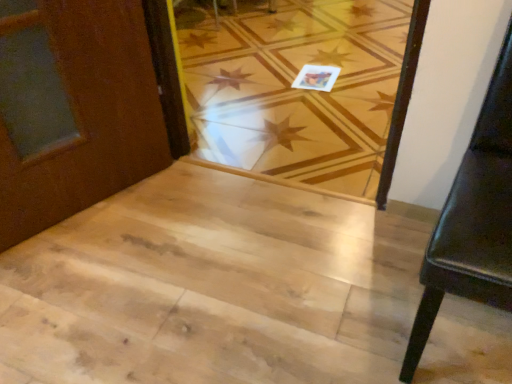
Question: Is natural wood stairwell at center in front of natural wood floor at center?

Choices:
 (A) yes
 (B) no

Answer: (A)

Question: Is natural wood stairwell at center to the left of natural wood floor at center from the viewer's perspective?

Choices:
 (A) yes
 (B) no

Answer: (A)

Question: Is natural wood stairwell at center located outside natural wood floor at center?

Choices:
 (A) yes
 (B) no

Answer: (A)

Question: Would you consider natural wood stairwell at center to be distant from natural wood floor at center?

Choices:
 (A) no
 (B) yes

Answer: (A)

Question: Is natural wood stairwell at center taller than natural wood floor at center?

Choices:
 (A) yes
 (B) no

Answer: (B)

Question: Relative to natural wood stairwell at center, is black leather chair at right in front or behind?

Choices:
 (A) front
 (B) behind

Answer: (A)

Question: Does point 461,215 appear closer or farther from the camera than point 182,337?

Choices:
 (A) closer
 (B) farther

Answer: (A)

Question: Is black leather chair at right taller or shorter than natural wood stairwell at center?

Choices:
 (A) tall
 (B) short

Answer: (A)

Question: Is black leather chair at right to the left or to the right of natural wood stairwell at center in the image?

Choices:
 (A) left
 (B) right

Answer: (B)

Question: Is black leather chair at right to the left or to the right of natural wood floor at center in the image?

Choices:
 (A) right
 (B) left

Answer: (A)

Question: In terms of size, does black leather chair at right appear bigger or smaller than natural wood floor at center?

Choices:
 (A) small
 (B) big

Answer: (A)

Question: Is point (426, 332) positioned closer to the camera than point (336, 31)?

Choices:
 (A) farther
 (B) closer

Answer: (B)

Question: Is black leather chair at right situated inside natural wood floor at center or outside?

Choices:
 (A) inside
 (B) outside

Answer: (B)

Question: From the image's perspective, is natural wood floor at center located above or below natural wood stairwell at center?

Choices:
 (A) above
 (B) below

Answer: (A)

Question: Based on their positions, is natural wood floor at center located to the left or right of natural wood stairwell at center?

Choices:
 (A) left
 (B) right

Answer: (B)